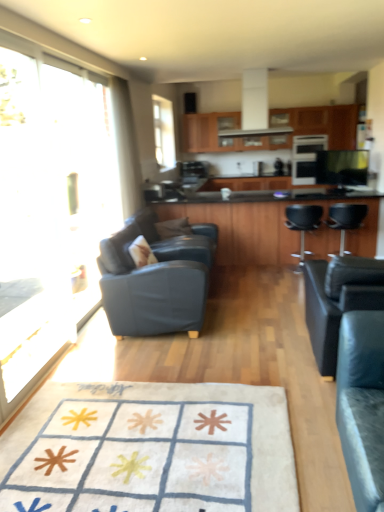
Question: Considering the positions of wooden cabinets at upper center and black laminate countertop at center in the image, is wooden cabinets at upper center taller or shorter than black laminate countertop at center?

Choices:
 (A) tall
 (B) short

Answer: (B)

Question: Is wooden cabinets at upper center spatially inside black laminate countertop at center, or outside of it?

Choices:
 (A) outside
 (B) inside

Answer: (A)

Question: Estimate the real-world distances between objects in this image. Which object is closer to the black laminate countertop at center?

Choices:
 (A) transparent glass window at upper center
 (B) transparent glass door at left
 (C) wooden cabinets at upper center
 (D) black plastic coffee machine at center
 (E) black leather chair at right, the 1th chair viewed from the right

Answer: (E)

Question: Based on their relative distances, which object is farther from the white fabric doormat at center?

Choices:
 (A) black leather bar stool at center right, which appears as the second chair when viewed from the right
 (B) black leather chair at right, which is counted as the fourth chair, starting from the left
 (C) transparent glass door at left
 (D) black plastic coffee machine at center
 (E) black leather chair at right, positioned as the 3th chair in right-to-left order

Answer: (D)